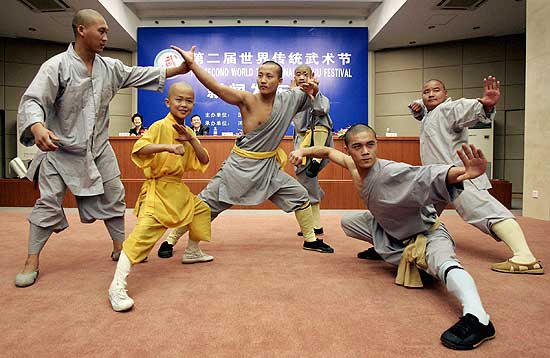
At what (x,y) coordinates should I click in order to perform the action: click on carpet. Please return your answer as a coordinate pair (x, y). Looking at the image, I should click on (288, 293).